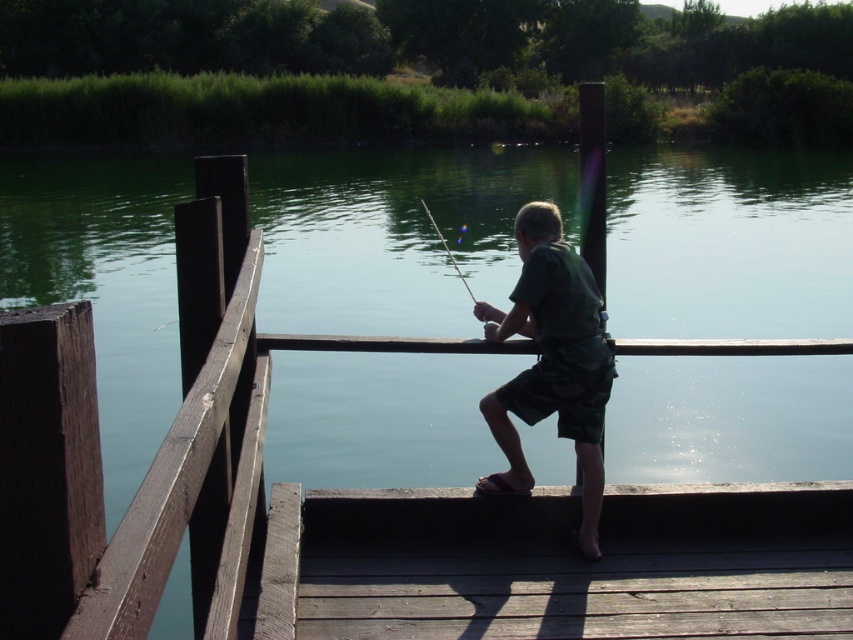
Can you confirm if brown wooden dock at lower center is positioned to the right of metallic fishing rod at center?

In fact, brown wooden dock at lower center is to the left of metallic fishing rod at center.

Who is more distant from viewer, (549,621) or (599,269)?

Positioned behind is point (599,269).

Between point (787, 621) and point (582, 216), which one is positioned behind?

The point (582, 216) is more distant.

What are the coordinates of `brown wooden dock at lower center` in the screenshot? It's located at (560, 563).

Is brown wooden dock at lower center in front of green matte shirt at center?

Yes, brown wooden dock at lower center is closer to the viewer.

Which is in front, point (476, 496) or point (599, 321)?

Point (599, 321)

At what (x,y) coordinates should I click in order to perform the action: click on brown wooden dock at lower center. Please return your answer as a coordinate pair (x, y). Image resolution: width=853 pixels, height=640 pixels. Looking at the image, I should click on (560, 563).

In the scene shown: Who is more distant from viewer, [595,410] or [451,257]?

Result: Positioned behind is point [451,257].

Can you confirm if green matte shirt at center is wider than smooth black rod at center?

Incorrect, green matte shirt at center's width does not surpass smooth black rod at center's.

Measure the distance between green matte shirt at center and camera.

green matte shirt at center is 4.06 meters away from camera.

This screenshot has height=640, width=853. Identify the location of green matte shirt at center. (550, 362).